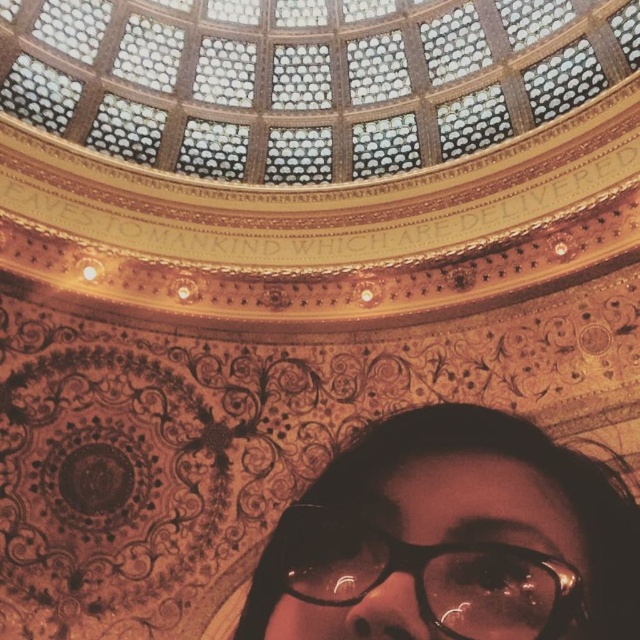
Does matte black glasses at bottom have a greater width compared to black plastic glasses at bottom?

Yes.

Between matte black glasses at bottom and black plastic glasses at bottom, which one appears on the left side from the viewer's perspective?

black plastic glasses at bottom

Who is more forward, (472, 582) or (390, 557)?

Positioned in front is point (472, 582).

At what (x,y) coordinates should I click in order to perform the action: click on matte black glasses at bottom. Please return your answer as a coordinate pair (x, y). Image resolution: width=640 pixels, height=640 pixels. Looking at the image, I should click on (451, 540).